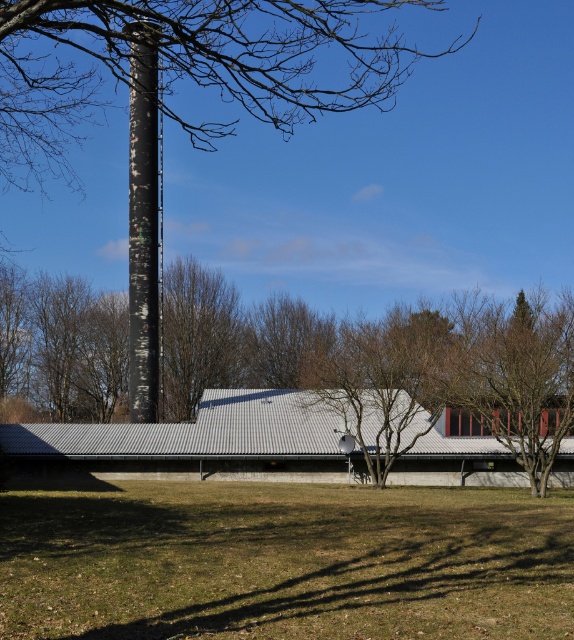
Question: Which point is closer to the camera?

Choices:
 (A) black matte chimney at center
 (B) gray corrugated metal barn at center
 (C) brown textured tree at center
 (D) green grass at lower center

Answer: (A)

Question: Is green grass at lower center above brown textured tree at center?

Choices:
 (A) yes
 (B) no

Answer: (B)

Question: Is brown textured tree at center further to the viewer compared to gray corrugated metal barn at center?

Choices:
 (A) no
 (B) yes

Answer: (A)

Question: Among these objects, which one is farthest from the camera?

Choices:
 (A) green grass at lower center
 (B) black matte chimney at center
 (C) brown textured tree at center

Answer: (C)

Question: Considering the real-world distances, which object is closest to the green grass at lower center?

Choices:
 (A) brown textured tree at center
 (B) black matte chimney at center

Answer: (B)

Question: Does brown textured tree at center have a smaller size compared to black matte chimney at center?

Choices:
 (A) no
 (B) yes

Answer: (A)